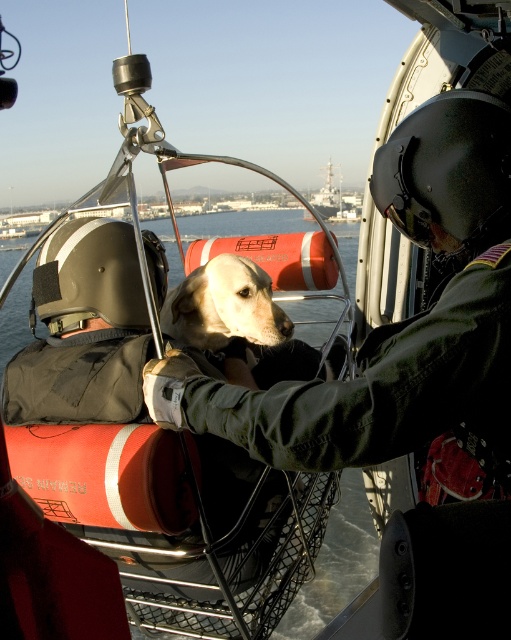
Question: Is golden fur dog at center behind metallic gray ship at center?

Choices:
 (A) yes
 (B) no

Answer: (B)

Question: Does golden fur dog at center have a larger size compared to metallic gray ship at center?

Choices:
 (A) no
 (B) yes

Answer: (A)

Question: Which point is farther to the camera?

Choices:
 (A) metallic gray ship at center
 (B) golden fur dog at center

Answer: (A)

Question: Is golden fur dog at center smaller than metallic gray ship at center?

Choices:
 (A) no
 (B) yes

Answer: (B)

Question: Which of the following is the farthest from the observer?

Choices:
 (A) (243, 332)
 (B) (355, 209)

Answer: (B)